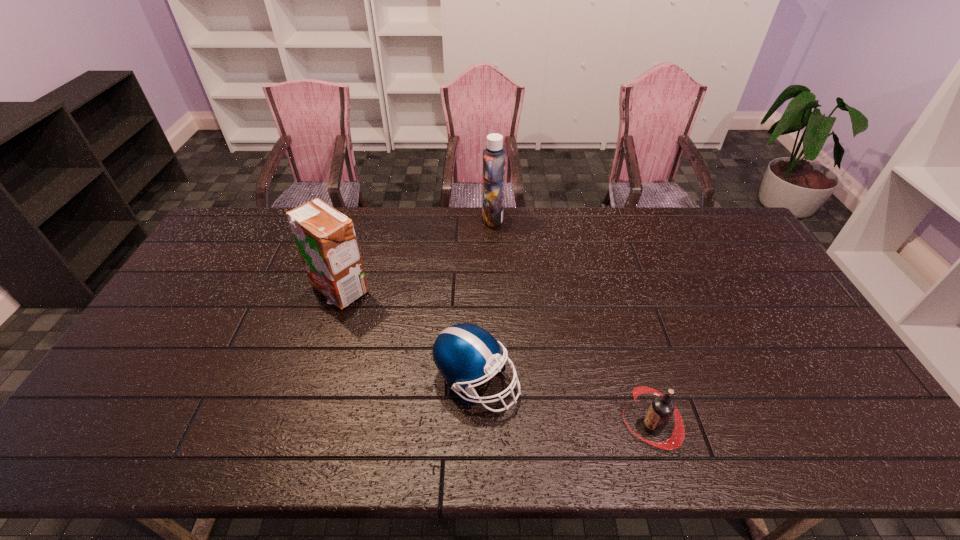
You are a GUI agent. You are given a task and a screenshot of the screen. Output one action in this format:
    pyautogui.click(x=<x>, y=<y>)
    Task: Click on the vacant space located on the label of the rightmost object
    This screenshot has height=540, width=960.
    Given the screenshot: What is the action you would take?
    pyautogui.click(x=574, y=426)

Image resolution: width=960 pixels, height=540 pixels. What are the coordinates of `vacant space located on the label of the rightmost object` in the screenshot? It's located at (498, 426).

At what (x,y) coordinates should I click in order to perform the action: click on blank space located on the label of the rightmost object. Please return your answer as a coordinate pair (x, y). Looking at the image, I should click on (574, 426).

I want to click on object that is at the far edge, so click(494, 156).

Find the location of `object at the near edge`. object at the near edge is located at coordinates [661, 409].

Locate an element on the screen. Image resolution: width=960 pixels, height=540 pixels. free space at the far edge of the desktop is located at coordinates (477, 211).

Locate an element on the screen. Image resolution: width=960 pixels, height=540 pixels. vacant area at the near edge of the desktop is located at coordinates (421, 426).

Where is `free point at the left edge`? Image resolution: width=960 pixels, height=540 pixels. free point at the left edge is located at coordinates pos(161,385).

In the image, there is a desktop. Find the location of `vacant space at the right edge`. vacant space at the right edge is located at coordinates (778, 315).

At what (x,y) coordinates should I click in order to perform the action: click on free spot at the far right corner of the desktop. Please return your answer as a coordinate pair (x, y). Looking at the image, I should click on (706, 208).